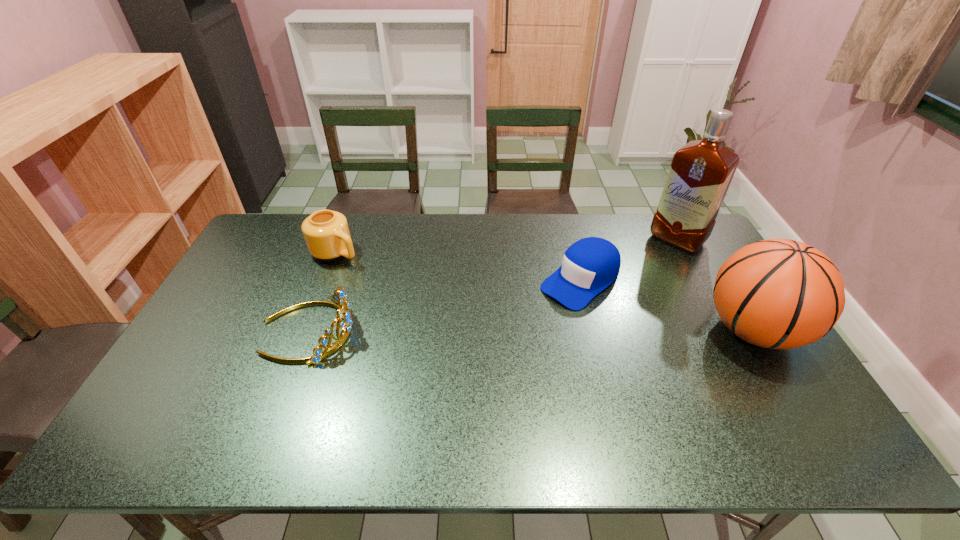
You are a GUI agent. You are given a task and a screenshot of the screen. Output one action in this format:
    pyautogui.click(x=<x>, y=<y>)
    Task: Click on the vacant area that lies between the mug and the baseball cap
    The image size is (960, 540).
    Given the screenshot: What is the action you would take?
    pyautogui.click(x=458, y=267)

Locate an element on the screen. This screenshot has width=960, height=540. vacant area that lies between the tallest object and the tiara is located at coordinates (492, 285).

This screenshot has height=540, width=960. Identify the location of blank region between the liquor and the baseball cap. (629, 260).

This screenshot has height=540, width=960. In order to click on vacant space that is in between the baseball cap and the mug in this screenshot , I will do `click(458, 267)`.

Where is `free space between the shortest object and the tiara`? free space between the shortest object and the tiara is located at coordinates click(444, 306).

I want to click on free spot between the shortest object and the mug, so click(458, 267).

At what (x,y) coordinates should I click in order to perform the action: click on free spot between the tallest object and the mug. Please return your answer as a coordinate pair (x, y). Looking at the image, I should click on (506, 246).

The height and width of the screenshot is (540, 960). In order to click on object that is the nearest to the shortest object in this screenshot , I will do coord(700,174).

Choose which object is the third nearest neighbor to the second tallest object. Please provide its 2D coordinates. Your answer should be formatted as a tuple, i.e. [(x, y)], where the tuple contains the x and y coordinates of a point satisfying the conditions above.

[(339, 296)]

This screenshot has width=960, height=540. What are the coordinates of `vacant space that satisfies the following two spatial constraints: 1. on the front side of the mug; 2. on the left side of the fourth shortest object` in the screenshot? It's located at (305, 330).